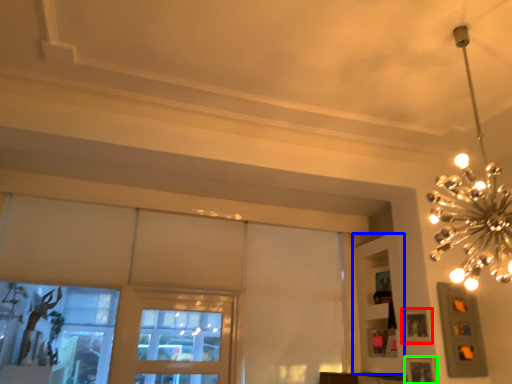
Question: Based on their relative distances, which object is farther from picture frame (highlighted by a red box)? Choose from shelf (highlighted by a blue box) and picture frame (highlighted by a green box).

Choices:
 (A) shelf
 (B) picture frame

Answer: (A)